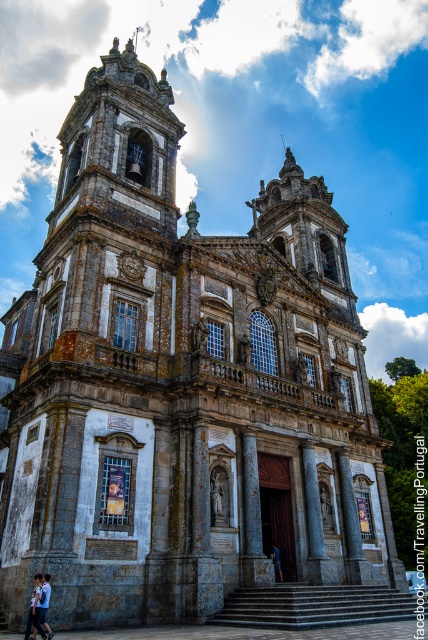
Looking at this image, is light blue shirt at lower left bigger than dark blue fabric at lower center?

Correct, light blue shirt at lower left is larger in size than dark blue fabric at lower center.

Can you confirm if light blue shirt at lower left is positioned to the left of dark blue fabric at lower center?

Indeed, light blue shirt at lower left is positioned on the left side of dark blue fabric at lower center.

Is point (39, 598) closer to camera compared to point (282, 576)?

That is True.

I want to click on light blue shirt at lower left, so click(44, 604).